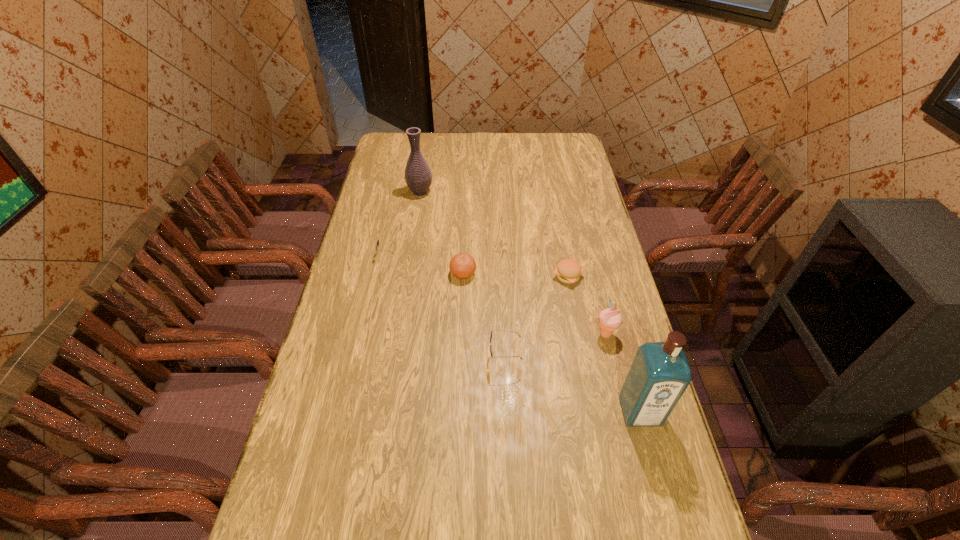
With all sunglassess evenly spaced, where should an extra sunglasses be placed on the right to continue the pattern? Please point out a vacant space. Please provide its 2D coordinates. Your answer should be formatted as a tuple, i.e. [(x, y)], where the tuple contains the x and y coordinates of a point satisfying the conditions above.

[(694, 525)]